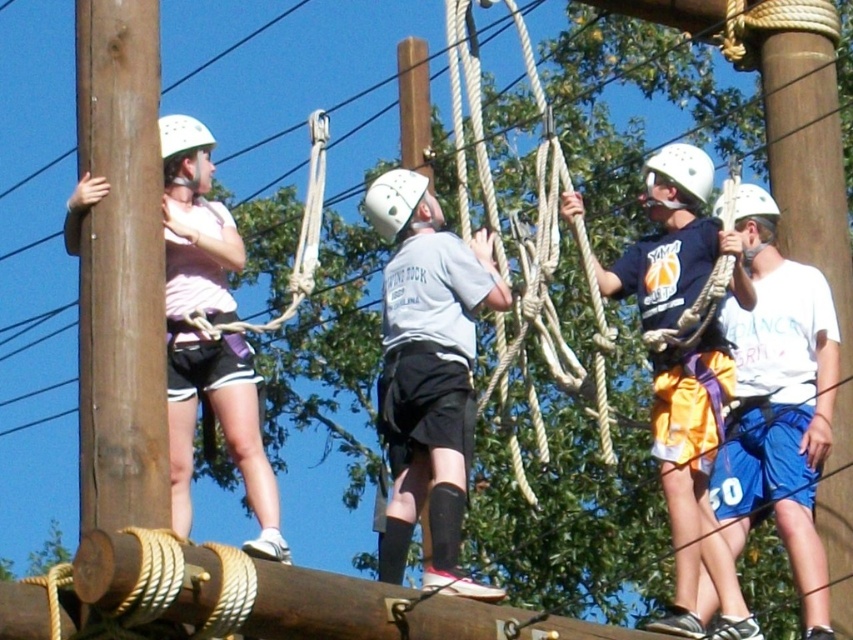
You are observing the woman on the left who is holding onto the wooden post. There are two points marked on the post. One is at coordinate point (405, 456) and the other is at point (744, 198). Which of these two points is nearer to your viewpoint?

Point (405, 456) is closer to the camera than point (744, 198).

In the image, there is a woman wearing a matte pink shirt at left. What are the coordinates of her position?

The coordinates of the matte pink shirt at left are at point (210,353).